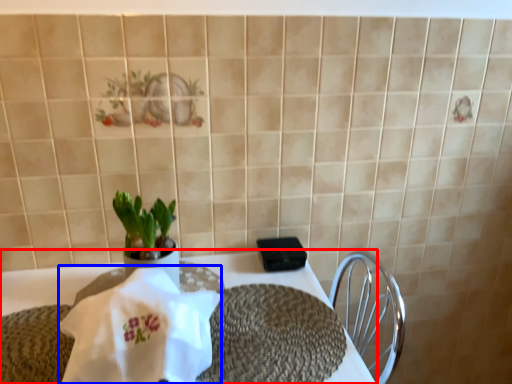
Question: Among these objects, which one is farthest to the camera, table (highlighted by a red box) or cloth (highlighted by a blue box)?

Choices:
 (A) table
 (B) cloth

Answer: (A)